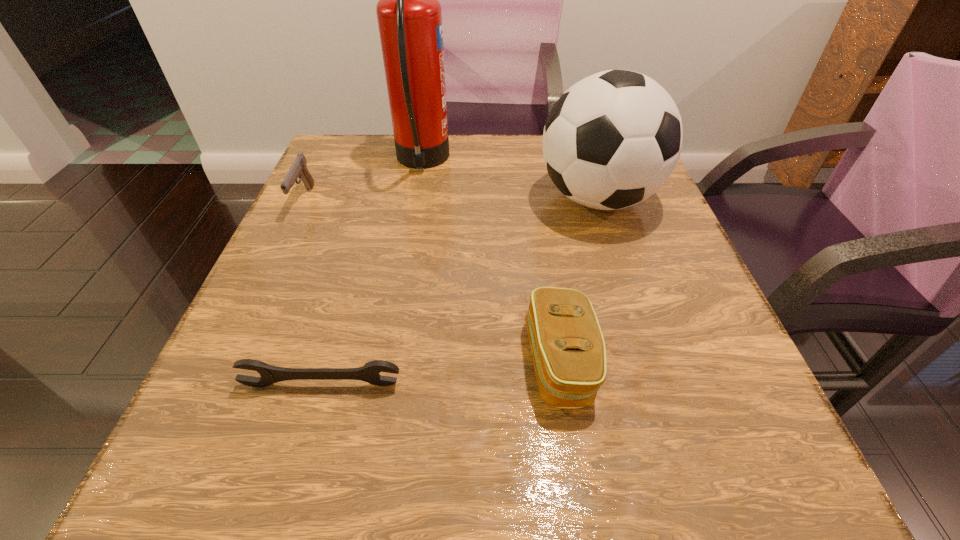
This screenshot has height=540, width=960. Find the location of `vacant point that satisfies the following two spatial constraints: 1. on the surface of the fire extinguisher; 2. at the barrel of the pistol`. vacant point that satisfies the following two spatial constraints: 1. on the surface of the fire extinguisher; 2. at the barrel of the pistol is located at coordinates (415, 200).

At what (x,y) coordinates should I click in order to perform the action: click on vacant space that satisfies the following two spatial constraints: 1. on the surface of the fire extinguisher; 2. on the open ends of the shortest object. Please return your answer as a coordinate pair (x, y). The width and height of the screenshot is (960, 540). Looking at the image, I should click on (382, 384).